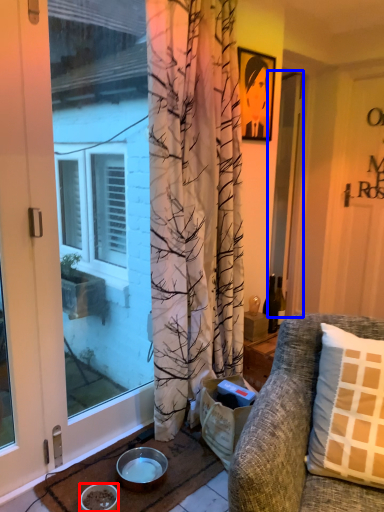
Question: Which object is further to the camera taking this photo, bowl (highlighted by a red box) or screen door (highlighted by a blue box)?

Choices:
 (A) bowl
 (B) screen door

Answer: (B)